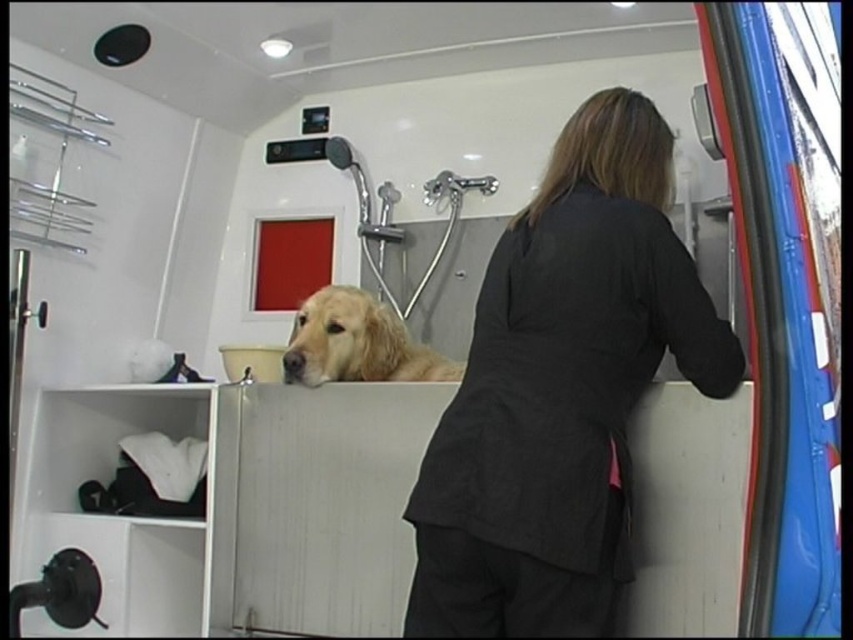
You are a groomer who needs to reach the dark gray fabric coat at center while standing at the camera position. Can you comfortably reach it without moving your position? The average human arm length is about 0.7 meters.

The dark gray fabric coat at center is 1.30 meters away from the camera. Since the average human arm length is 0.7 meters, the distance is greater than the arm length, so you cannot comfortably reach it without moving.

You are a groomer working in a pet grooming van. You need to reach the dark gray fabric coat at center while standing near the golden fur dog at center. Is the distance between them sufficient for you to comfortably stretch and grab the coat without moving your feet?

The dark gray fabric coat at center and golden fur dog at center are 31.30 inches apart. Since the average comfortable reaching distance for an adult without moving feet is around 24 to 30 inches, the 31.30 inches might be slightly out of comfortable reach, requiring a small step or adjustment.

You are a groomer preparing to dress the golden fur dog at center after its bath. You have a dark gray fabric coat at center. Will the coat be wide enough to cover the dog?

The dark gray fabric coat at center is wider than the golden fur dog at center, so it should be wide enough to cover the dog.